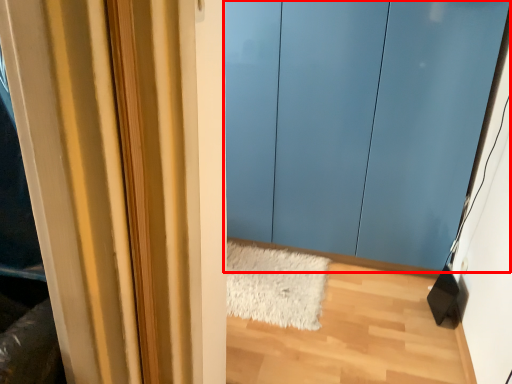
Question: Observing the image, what is the correct spatial positioning of door (annotated by the red box) in reference to doormat?

Choices:
 (A) left
 (B) right

Answer: (B)